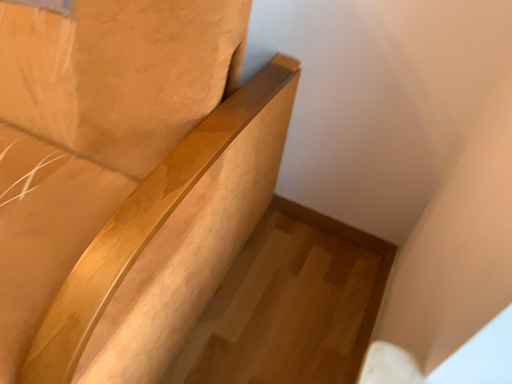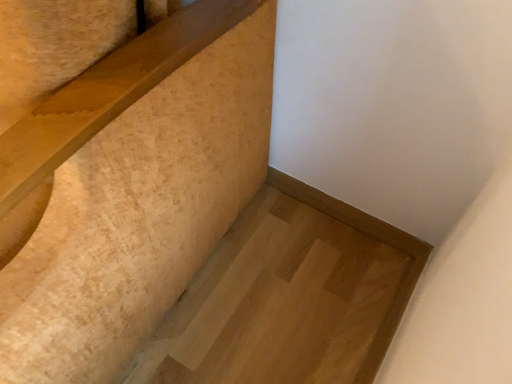
Question: How did the camera likely rotate when shooting the video?

Choices:
 (A) rotated downward
 (B) rotated upward

Answer: (A)